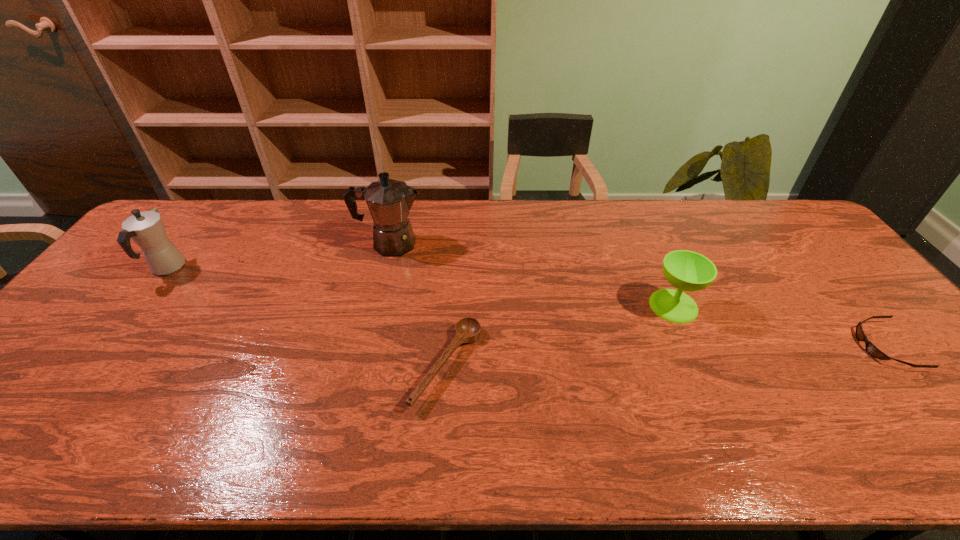
Locate an element on the screen. free spot that satisfies the following two spatial constraints: 1. on the front side of the second object from right to left; 2. on the left side of the shorter coffeepot is located at coordinates (138, 306).